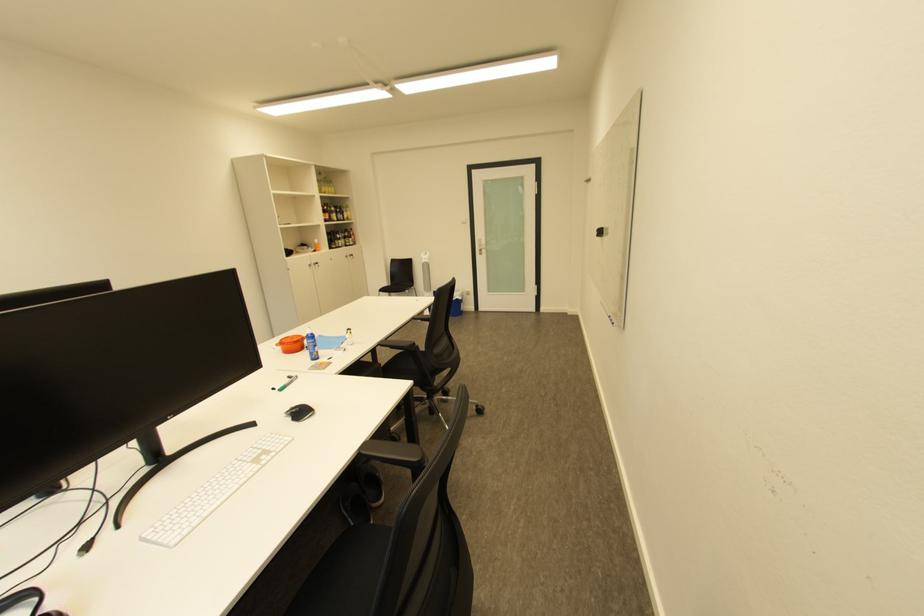
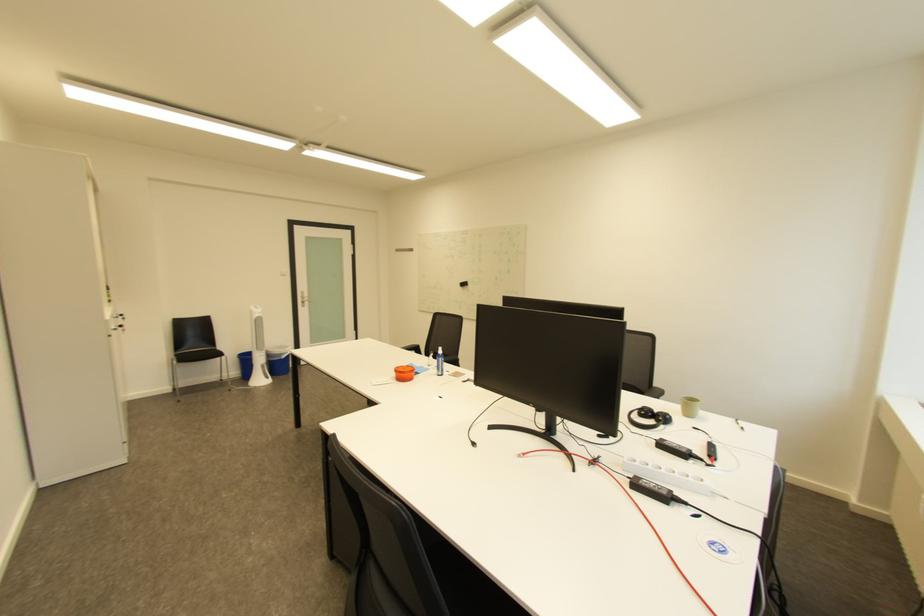
Question: I am providing you with two images of the same scene from different viewpoints. Which of the following objects are not visible in image2?

Choices:
 (A) black headphones
 (B) blue patterned vase
 (C) black computer mouse
 (D) orange lidded container

Answer: (C)